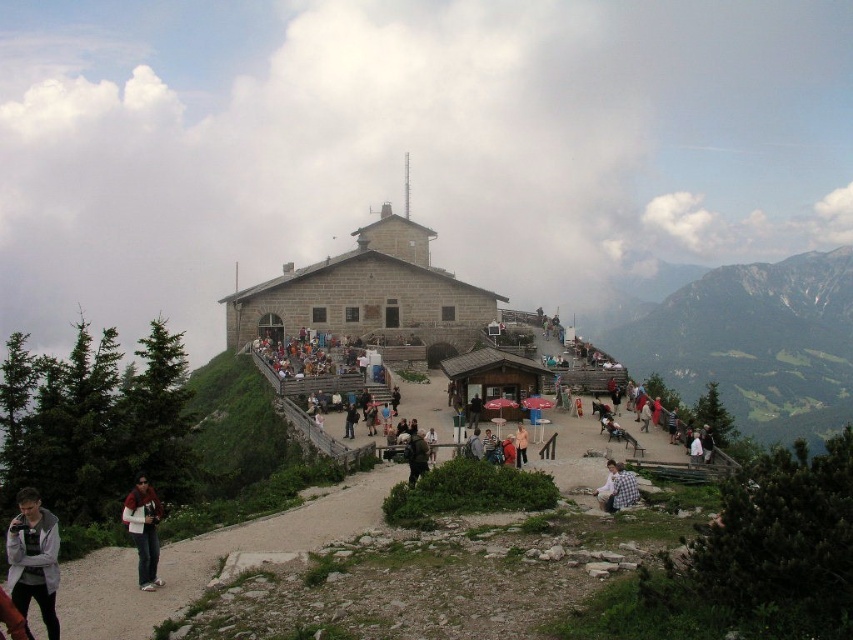
You are a photographer at the mountain top visitor center. You notice two people in the crowd below you. One is wearing a checkered fabric shirt at lower right and the other has a dark gray jacket at center. Which person is positioned lower in the scene?

The checkered fabric shirt at lower right is located below dark gray jacket at center, so the person wearing the checkered fabric shirt at lower right is positioned lower in the scene.

You are standing at the center of the paved area near the stone building and want to find the matte black jacket at lower left. In which direction should you look to see it?

The matte black jacket at lower left is located at point (143, 531), which is to the lower left direction from your current position at the center of the paved area.

You are standing at the base of the mountain and want to reach the point marked as point (143, 552). Given that your average walking speed is 1.5 meters per second, how long will it take you to reach that point?

The distance to point (143, 552) is 49.22 meters. At a speed of 1.5 meters per second, it would take approximately 32.8 seconds to reach the point.